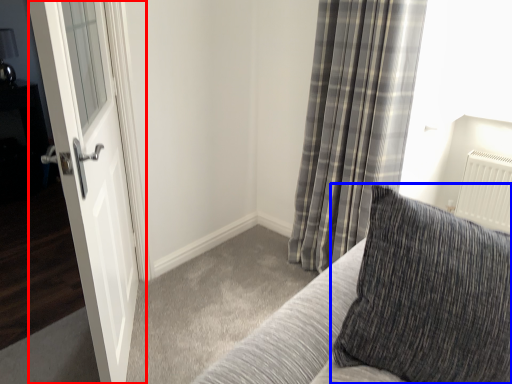
Question: Among these objects, which one is farthest to the camera, door (highlighted by a red box) or pillow (highlighted by a blue box)?

Choices:
 (A) door
 (B) pillow

Answer: (A)